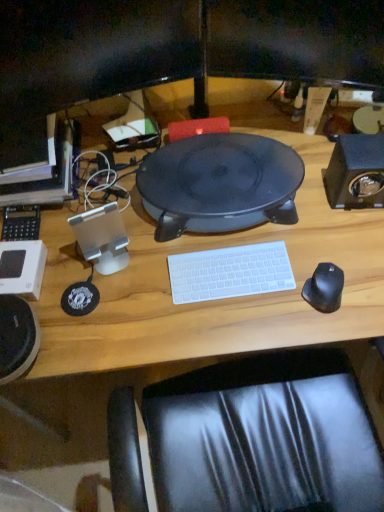
The width and height of the screenshot is (384, 512). I want to click on free spot above white plastic keyboard at center (from a real-world perspective), so click(x=229, y=269).